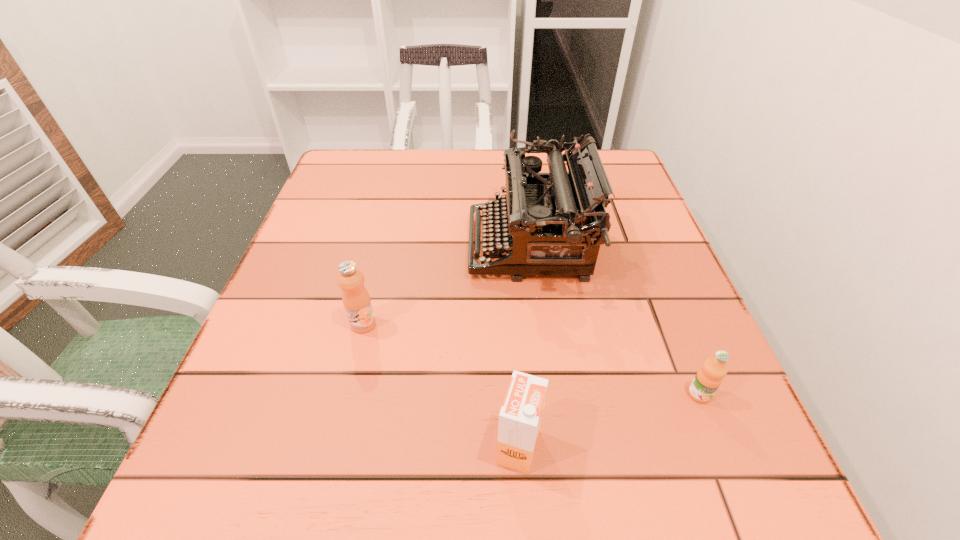
What are the coordinates of `orange juice that stands as the second closest to the second orange juice from right to left` in the screenshot? It's located at (356, 300).

In order to click on vacant space that satisfies the following two spatial constraints: 1. on the front label of the leftmost orange juice; 2. on the left side of the nearest object in this screenshot , I will do `click(333, 447)`.

The image size is (960, 540). I want to click on free space that satisfies the following two spatial constraints: 1. on the front label of the second orange juice from right to left; 2. on the left side of the leftmost orange juice, so click(x=333, y=447).

Identify the location of free point that satisfies the following two spatial constraints: 1. on the keyboard of the farthest object; 2. on the front label of the leftmost orange juice. The height and width of the screenshot is (540, 960). (540, 324).